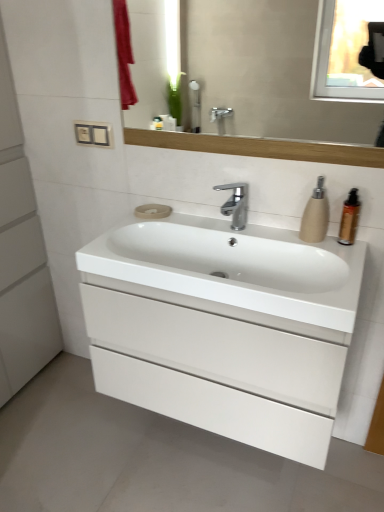
The width and height of the screenshot is (384, 512). I want to click on free space on the front side of brown glossy bottle at right, so click(x=349, y=258).